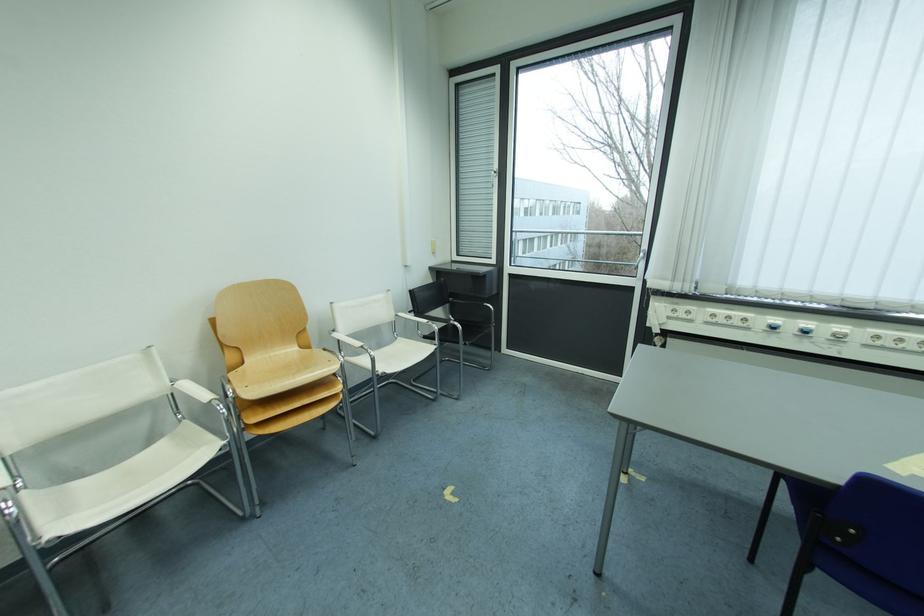
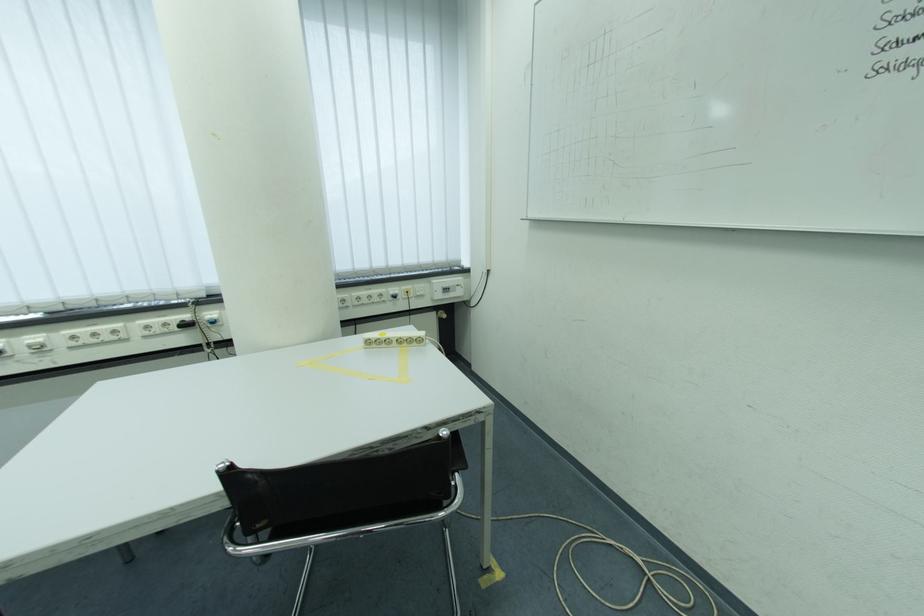
In the second image, find the point that corresponds to (x=885, y=339) in the first image.

(82, 339)